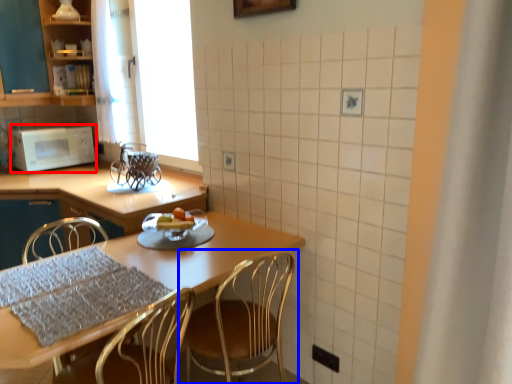
Question: Which point is closer to the camera, microwave oven (highlighted by a red box) or chair (highlighted by a blue box)?

Choices:
 (A) microwave oven
 (B) chair

Answer: (B)